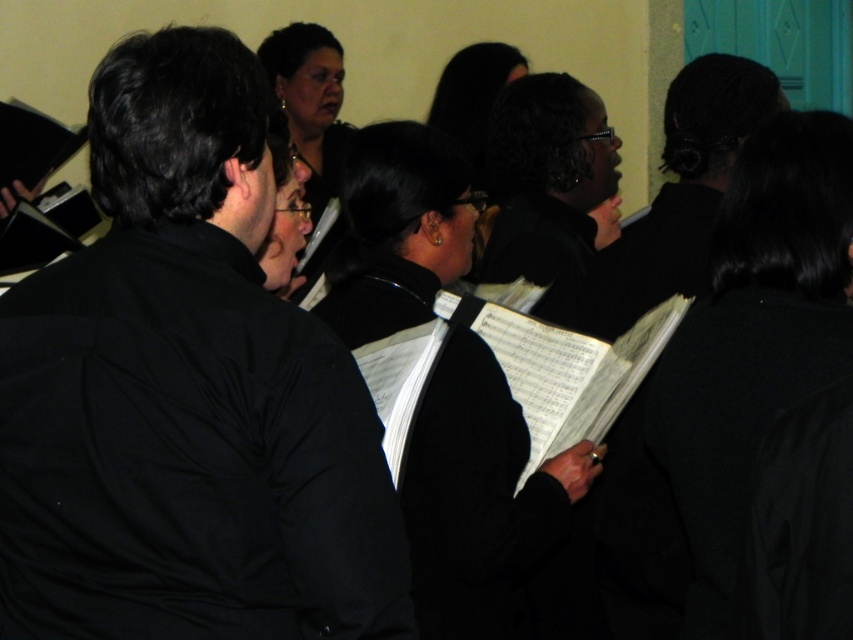
Question: Considering the real-world distances, which object is closest to the black matte book at center?

Choices:
 (A) black matte choir book at center
 (B) black matte jacket at center
 (C) black glossy hair at upper center

Answer: (A)

Question: Which point is closer to the camera taking this photo?

Choices:
 (A) (726, 488)
 (B) (207, 428)
 (C) (291, 132)

Answer: (B)

Question: Which point is farther to the camera?

Choices:
 (A) black matte jacket at center
 (B) black matte book at center
 (C) black glossy hair at upper center
 (D) black matte choir book at center

Answer: (C)

Question: Considering the relative positions of black matte jacket at center and black matte book at center in the image provided, where is black matte jacket at center located with respect to black matte book at center?

Choices:
 (A) below
 (B) above

Answer: (B)

Question: Can you confirm if black matte book at center is positioned to the right of black matte choir book at center?

Choices:
 (A) no
 (B) yes

Answer: (B)

Question: Is black matte book at center closer to the viewer compared to black glossy hair at upper center?

Choices:
 (A) no
 (B) yes

Answer: (B)